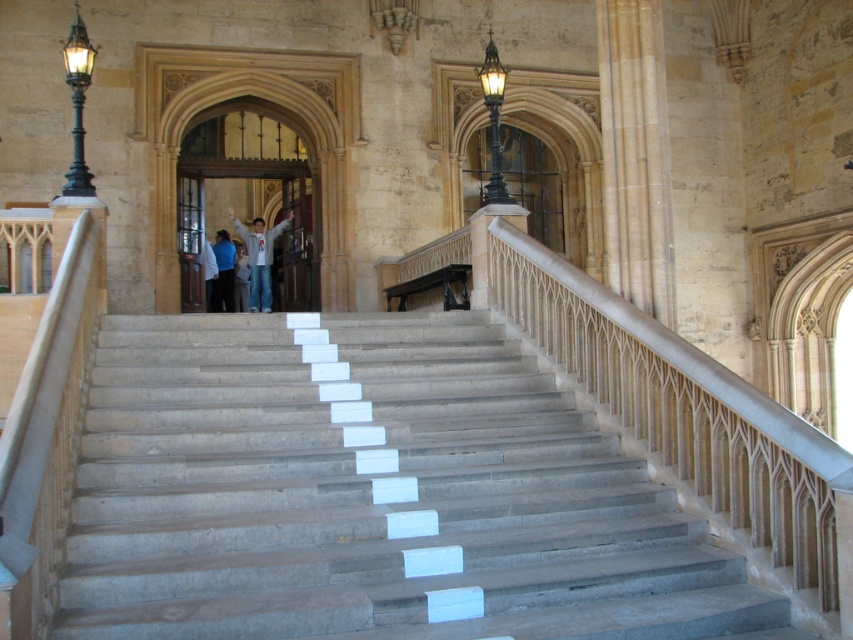
Question: Can you confirm if white cotton shirt at center is positioned to the right of wooden balustrade at center?

Choices:
 (A) no
 (B) yes

Answer: (A)

Question: Is white cotton shirt at center positioned before blue denim jeans at center?

Choices:
 (A) yes
 (B) no

Answer: (A)

Question: Can you confirm if wooden balustrade at center is positioned above blue denim jeans at center?

Choices:
 (A) no
 (B) yes

Answer: (A)

Question: Which of the following is the farthest from the observer?

Choices:
 (A) (434, 273)
 (B) (253, 294)
 (C) (212, 296)

Answer: (C)

Question: Which object appears farthest from the camera in this image?

Choices:
 (A) blue denim jeans at center
 (B) white cotton shirt at center
 (C) blue shirt at center

Answer: (A)

Question: Among these objects, which one is nearest to the camera?

Choices:
 (A) wooden balustrade at center
 (B) blue shirt at center
 (C) gray stone stairs at center

Answer: (C)